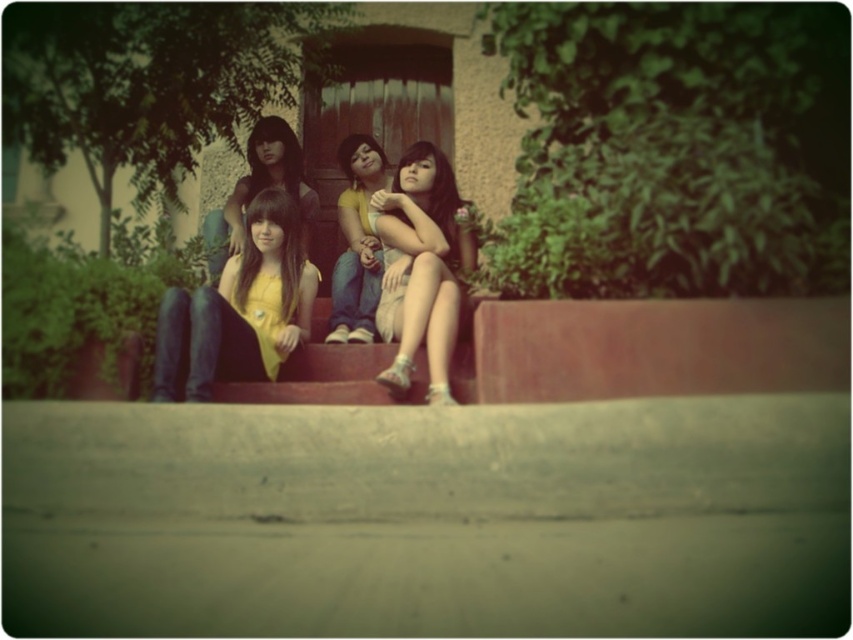
Can you confirm if yellow matte dress at center is taller than matte yellow shirt at center?

In fact, yellow matte dress at center may be shorter than matte yellow shirt at center.

Who is taller, yellow matte dress at center or matte yellow shirt at center?

With more height is matte yellow shirt at center.

This screenshot has height=640, width=853. Describe the element at coordinates (241, 307) in the screenshot. I see `yellow matte dress at center` at that location.

What are the coordinates of `yellow matte dress at center` in the screenshot? It's located at 241,307.

Can you confirm if yellow matte dress at center is positioned to the left of matte gray dress at center?

Yes, yellow matte dress at center is to the left of matte gray dress at center.

Does yellow matte dress at center lie in front of matte gray dress at center?

Yes, it is.

Does point (206, 372) come closer to viewer compared to point (454, 324)?

Yes, it is.

Where is `yellow matte dress at center`? Image resolution: width=853 pixels, height=640 pixels. yellow matte dress at center is located at coordinates (241, 307).

Who is positioned more to the right, matte gray dress at center or matte yellow shirt at center?

matte gray dress at center

Is point (434, 362) less distant than point (238, 198)?

Yes, it is in front of point (238, 198).

What are the coordinates of `matte gray dress at center` in the screenshot? It's located at (421, 268).